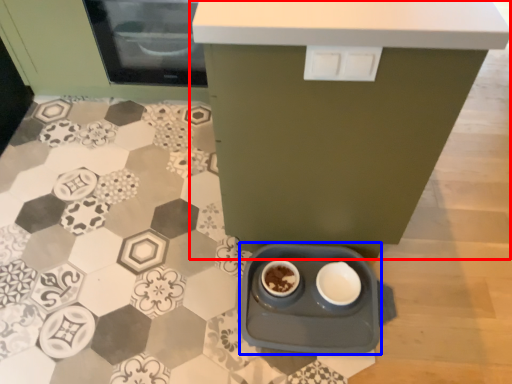
Question: Which object is further to the camera taking this photo, table (highlighted by a red box) or appliance (highlighted by a blue box)?

Choices:
 (A) table
 (B) appliance

Answer: (B)